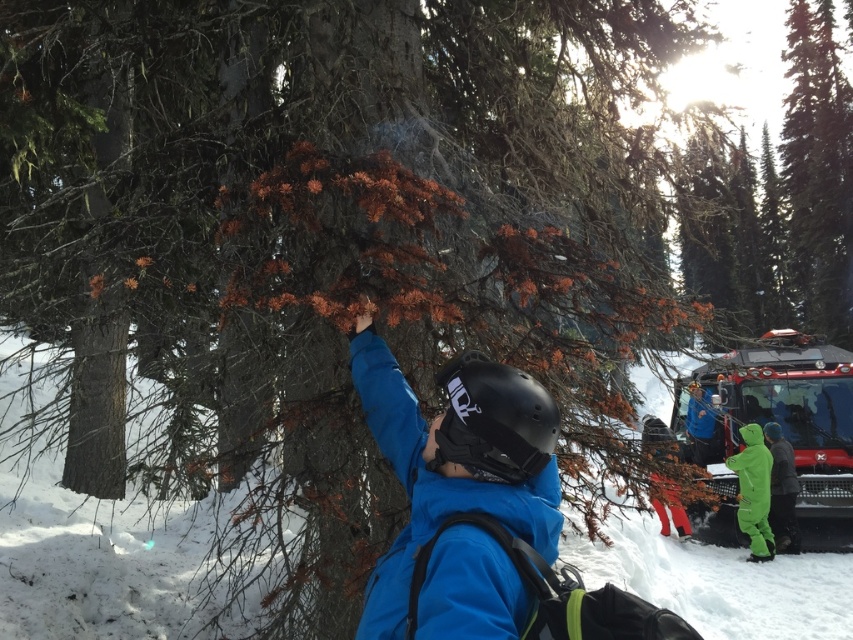
Question: Which point is farther to the camera?

Choices:
 (A) green ski suit at lower right
 (B) green matte snowsuit at lower right
 (C) blue matte jacket at center

Answer: (A)

Question: Which object appears closest to the camera in this image?

Choices:
 (A) blue matte jacket at center
 (B) white powdery snow at center
 (C) green matte snowsuit at lower right

Answer: (A)

Question: From the image, what is the correct spatial relationship of blue matte jacket at center in relation to green matte snowsuit at lower right?

Choices:
 (A) above
 (B) below

Answer: (A)

Question: Does green matte snowsuit at lower right have a larger size compared to green ski suit at lower right?

Choices:
 (A) no
 (B) yes

Answer: (B)

Question: Does blue matte jacket at center appear over green matte snowsuit at lower right?

Choices:
 (A) yes
 (B) no

Answer: (A)

Question: Which point is closer to the camera?

Choices:
 (A) green ski suit at lower right
 (B) white powdery snow at center
 (C) blue matte jacket at center

Answer: (C)